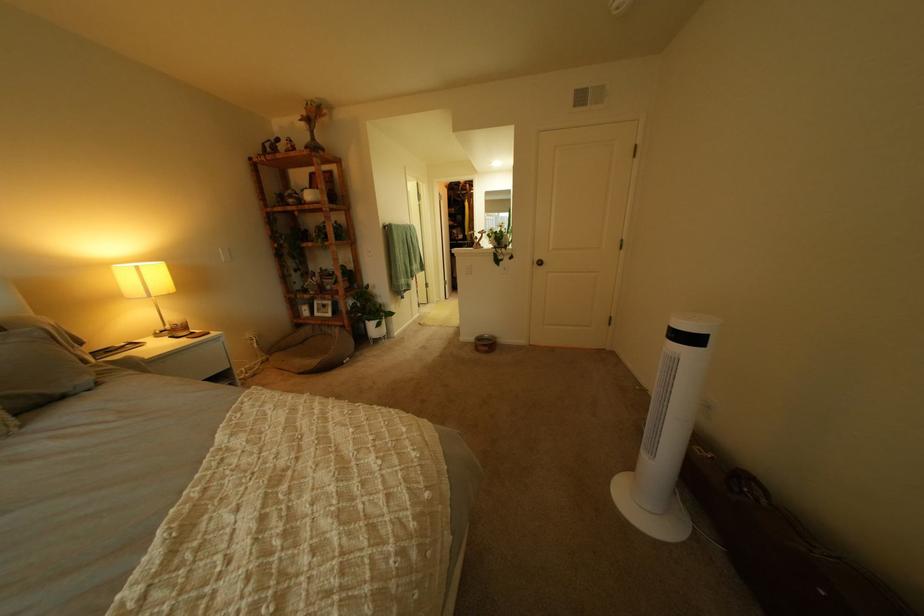
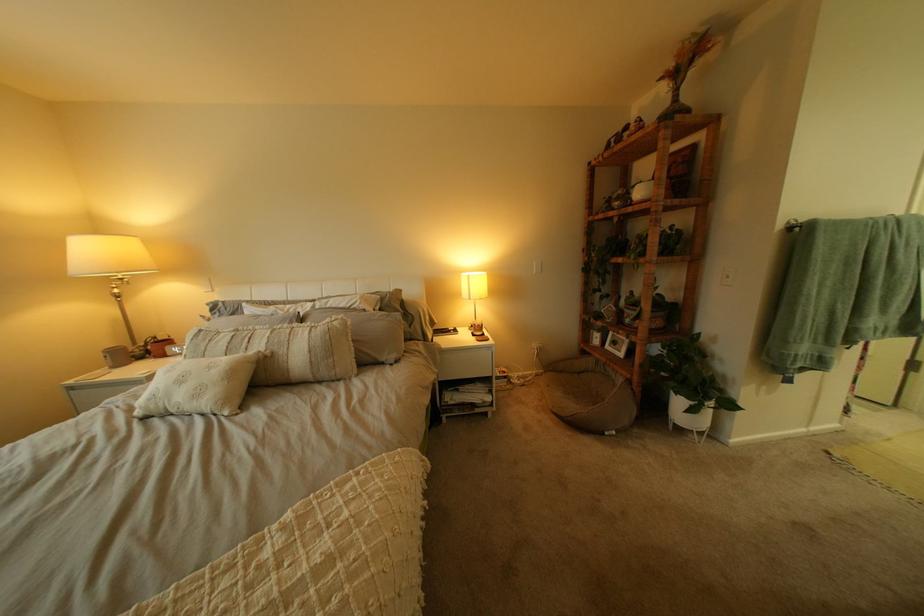
In the second image, find the point that corresponds to (x=333, y=315) in the first image.

(623, 347)